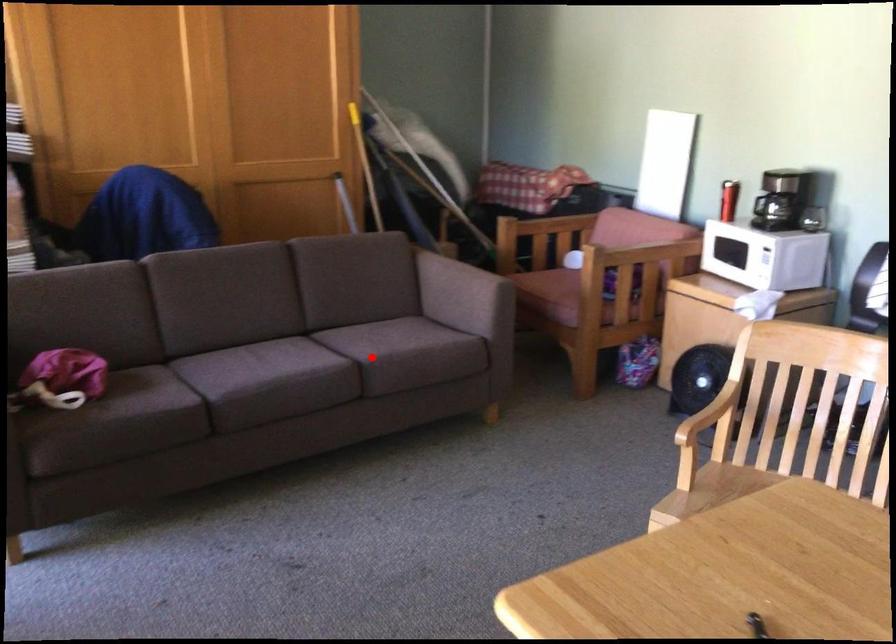
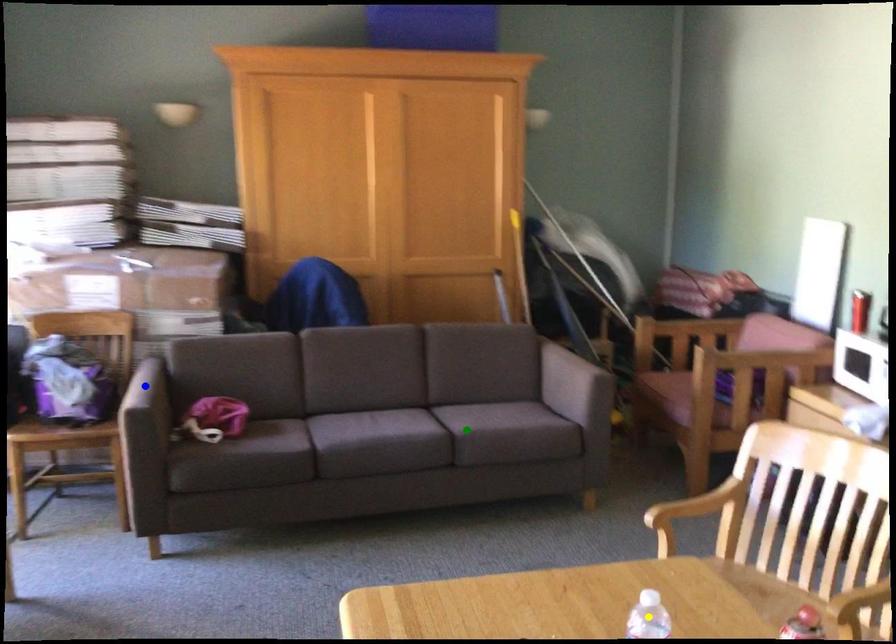
Question: I am providing you with two images of the same scene from different viewpoints. A red point is marked on the first image. You are given multiple points on the second image. Which spot in image 2 lines up with the point in image 1?

Choices:
 (A) green point
 (B) yellow point
 (C) blue point

Answer: (A)